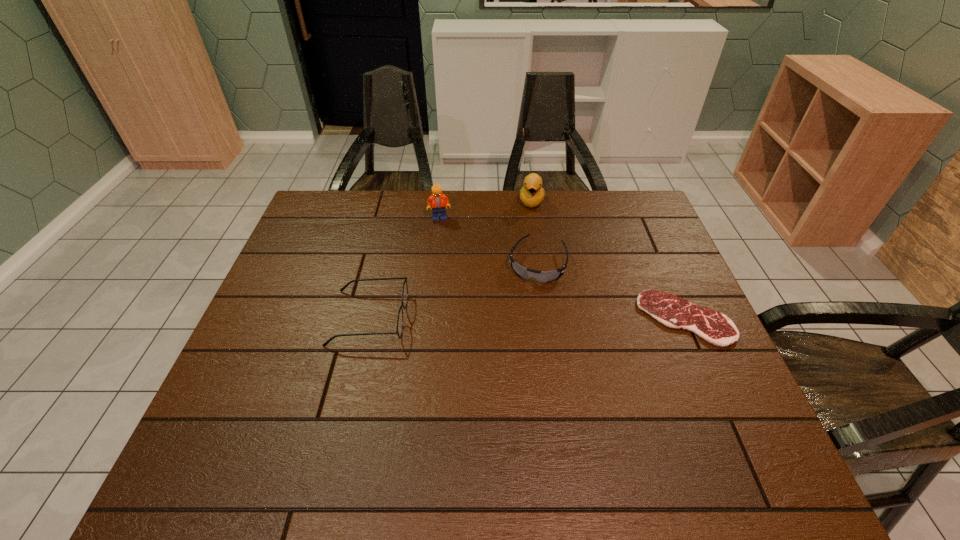
Find the location of a particular element. The height and width of the screenshot is (540, 960). vacant region between the leftmost object and the duckling is located at coordinates (450, 260).

At what (x,y) coordinates should I click in order to perform the action: click on vacant point located between the second shortest object and the Lego. Please return your answer as a coordinate pair (x, y). Image resolution: width=960 pixels, height=540 pixels. Looking at the image, I should click on (489, 240).

In order to click on vacant area that lies between the second shortest object and the duckling in this screenshot , I will do `click(535, 232)`.

What are the coordinates of `vacant region between the third nearest object and the third shortest object` in the screenshot? It's located at (453, 291).

Locate an element on the screen. free spot between the spectacles and the rightmost object is located at coordinates (527, 318).

Select which object is the third closest to the shortest object. Please provide its 2D coordinates. Your answer should be formatted as a tuple, i.e. [(x, y)], where the tuple contains the x and y coordinates of a point satisfying the conditions above.

[(437, 201)]

Locate an element on the screen. object that stands as the closest to the duckling is located at coordinates (541, 276).

The height and width of the screenshot is (540, 960). Identify the location of free space that satisfies the following two spatial constraints: 1. on the front side of the farthest object; 2. on the left side of the shortest object. (549, 319).